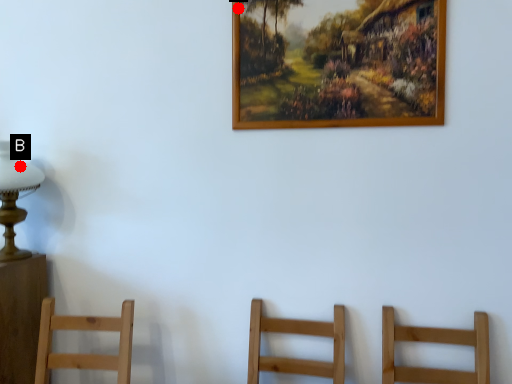
Question: Two points are circled on the image, labeled by A and B beside each circle. Which point appears closest to the camera in this image?

Choices:
 (A) A is closer
 (B) B is closer

Answer: (A)